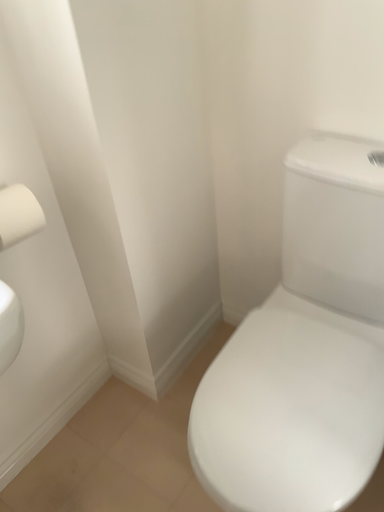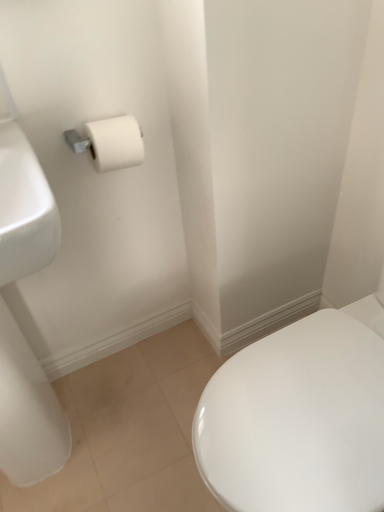
Question: Which way did the camera rotate in the video?

Choices:
 (A) rotated right
 (B) rotated left

Answer: (B)